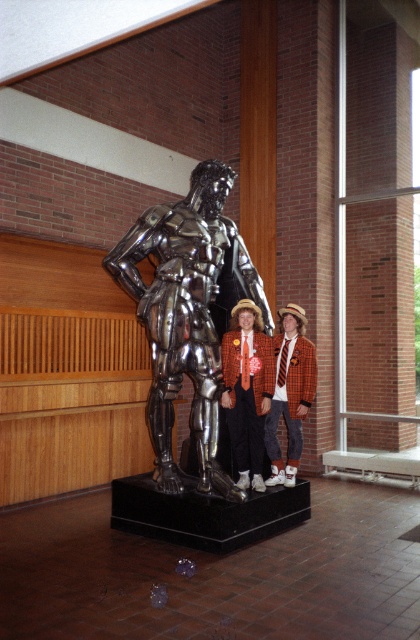
Is shiny metallic statue at center further to camera compared to orange wool blazer at center?

No.

Is point (238, 253) farther from camera compared to point (272, 432)?

No, it is in front of (272, 432).

Between point (217, 490) and point (268, 480), which one is positioned in front?

Point (217, 490) is in front.

What are the coordinates of `shiny metallic statue at center` in the screenshot? It's located at (189, 314).

Who is more distant from viewer, (205, 264) or (265, 388)?

Positioned behind is point (265, 388).

Where is `shiny metallic statue at center`? Image resolution: width=420 pixels, height=640 pixels. shiny metallic statue at center is located at coordinates (189, 314).

This screenshot has width=420, height=640. Describe the element at coordinates (189, 314) in the screenshot. I see `shiny metallic statue at center` at that location.

At what (x,y) coordinates should I click in order to perform the action: click on shiny metallic statue at center. Please return your answer as a coordinate pair (x, y). Looking at the image, I should click on (189, 314).

Between red plaid blazer at center and orange wool blazer at center, which one has more height?

orange wool blazer at center is taller.

Measure the distance between red plaid blazer at center and orange wool blazer at center.

red plaid blazer at center and orange wool blazer at center are 32.46 centimeters apart from each other.

Which is in front, point (223, 387) or point (307, 401)?

Point (223, 387) is more forward.

At what (x,y) coordinates should I click in order to perform the action: click on red plaid blazer at center. Please return your answer as a coordinate pair (x, y). Looking at the image, I should click on (246, 388).